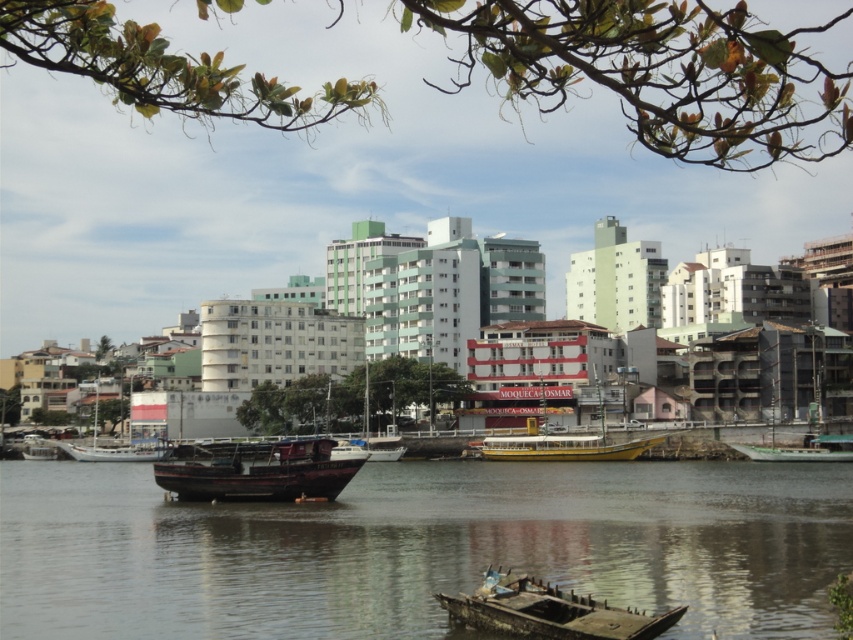
You are standing at the waterfront and want to board the brown wooden boat at lower center and the green matte boat at right. Which boat will you reach first if you walk straight towards them from your current position?

You will reach the brown wooden boat at lower center first because it is closer to you than the green matte boat at right.

You are standing on the dock and want to board the brown wooden boat at lower center and the green matte boat at right. Which boat is closer to your current position?

The brown wooden boat at lower center is closer to your current position because it is located below the green matte boat at right, meaning it is positioned closer to the dock where you are standing.

You are standing on the dock and see the rusty wood boat at center and the rusty metal boat at lower center. Which boat is closer to you?

The rusty wood boat at center is closer to you because the rusty metal boat at lower center is positioned behind it.